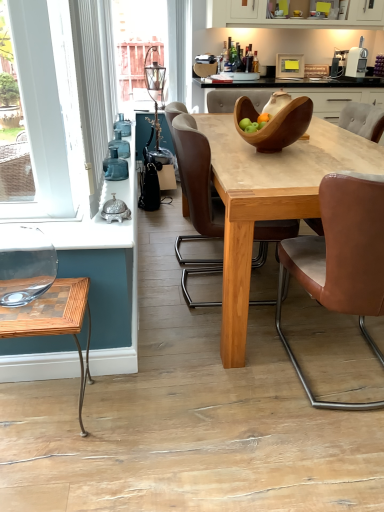
The image size is (384, 512). What are the coordinates of `free spot above wooden checkered coffee table at lower left (from a real-world perspective)` in the screenshot? It's located at (39, 298).